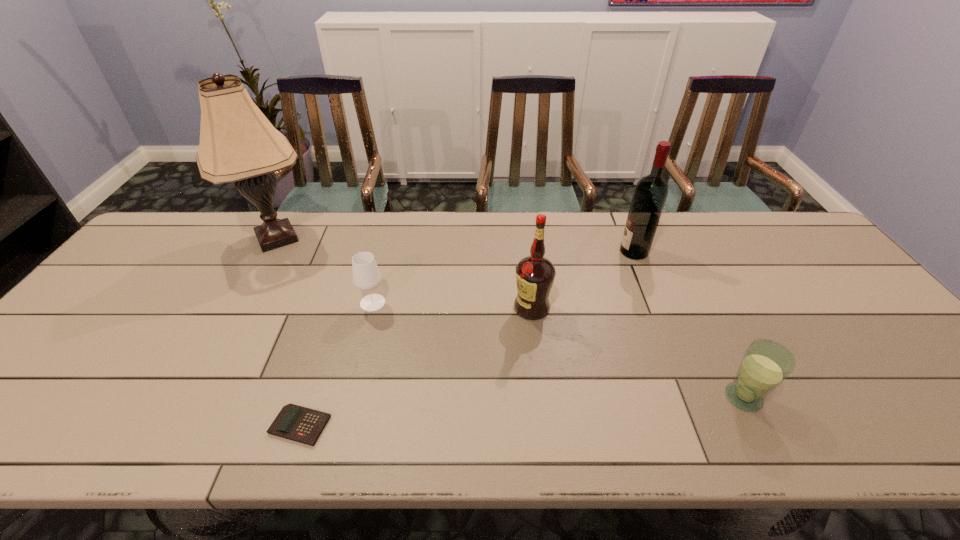
I want to click on lamp, so click(238, 144).

Find the location of a particular element. Image resolution: width=960 pixels, height=540 pixels. the leftmost object is located at coordinates (238, 144).

Locate an element on the screen. The height and width of the screenshot is (540, 960). the right alcohol is located at coordinates (651, 191).

Find the location of a particular element. This screenshot has width=960, height=540. the taller alcohol is located at coordinates (651, 191).

Identify the location of the fourth shortest object. (535, 274).

The height and width of the screenshot is (540, 960). I want to click on the left alcohol, so click(x=535, y=274).

The image size is (960, 540). Find the location of `the farther glass`. the farther glass is located at coordinates (366, 276).

Where is `the rightmost object`? the rightmost object is located at coordinates (x=765, y=364).

Find the location of `the right glass`. the right glass is located at coordinates (765, 364).

Where is `the shortest object`? the shortest object is located at coordinates [304, 425].